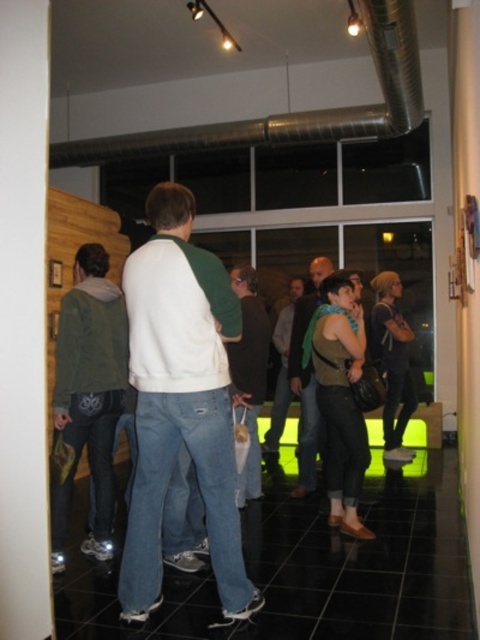
Is white cotton sweater at center wider than green scarf at center?

Yes.

Is point (192, 278) farther from viewer compared to point (309, 381)?

No, it is in front of (309, 381).

Is point (228, 372) less distant than point (312, 294)?

Yes, point (228, 372) is closer to viewer.

Find the location of `white cotton sweater at center`. white cotton sweater at center is located at coordinates (180, 403).